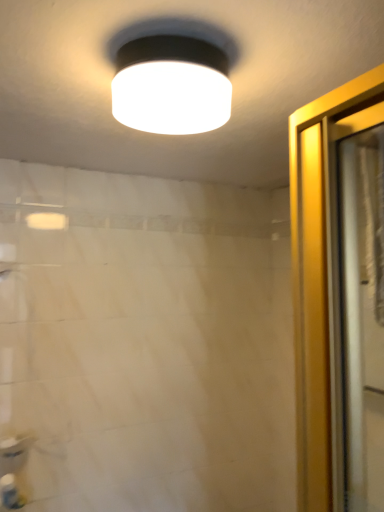
Question: Can you confirm if white matte lampshade at upper center is positioned to the left of white glossy sink at lower left?

Choices:
 (A) yes
 (B) no

Answer: (B)

Question: Is white matte lampshade at upper center surrounding white glossy sink at lower left?

Choices:
 (A) no
 (B) yes

Answer: (A)

Question: Is white matte lampshade at upper center shorter than white glossy sink at lower left?

Choices:
 (A) no
 (B) yes

Answer: (A)

Question: Is the position of white matte lampshade at upper center less distant than that of white glossy sink at lower left?

Choices:
 (A) yes
 (B) no

Answer: (A)

Question: From the image's perspective, is white matte lampshade at upper center beneath white glossy sink at lower left?

Choices:
 (A) no
 (B) yes

Answer: (A)

Question: Considering the positions of point (367, 187) and point (225, 81), is point (367, 187) closer or farther from the camera than point (225, 81)?

Choices:
 (A) farther
 (B) closer

Answer: (B)

Question: In the image, is translucent plastic shower curtain at right positioned in front of or behind white matte lampshade at upper center?

Choices:
 (A) behind
 (B) front

Answer: (A)

Question: From a real-world perspective, is translucent plastic shower curtain at right above or below white matte lampshade at upper center?

Choices:
 (A) above
 (B) below

Answer: (B)

Question: From the image's perspective, is translucent plastic shower curtain at right above or below white matte lampshade at upper center?

Choices:
 (A) above
 (B) below

Answer: (B)

Question: Looking at the image, does white matte lampshade at upper center seem bigger or smaller compared to translucent plastic shower curtain at right?

Choices:
 (A) big
 (B) small

Answer: (B)

Question: Looking at their shapes, would you say white matte lampshade at upper center is wider or thinner than translucent plastic shower curtain at right?

Choices:
 (A) thin
 (B) wide

Answer: (B)

Question: From the image's perspective, relative to translucent plastic shower curtain at right, is white matte lampshade at upper center above or below?

Choices:
 (A) below
 (B) above

Answer: (B)

Question: From their relative heights in the image, would you say white matte lampshade at upper center is taller or shorter than translucent plastic shower curtain at right?

Choices:
 (A) short
 (B) tall

Answer: (A)

Question: Considering the positions of white matte lampshade at upper center and white plastic bottle at lower left in the image, is white matte lampshade at upper center taller or shorter than white plastic bottle at lower left?

Choices:
 (A) tall
 (B) short

Answer: (B)

Question: Visually, is white matte lampshade at upper center positioned to the left or to the right of white plastic bottle at lower left?

Choices:
 (A) left
 (B) right

Answer: (B)